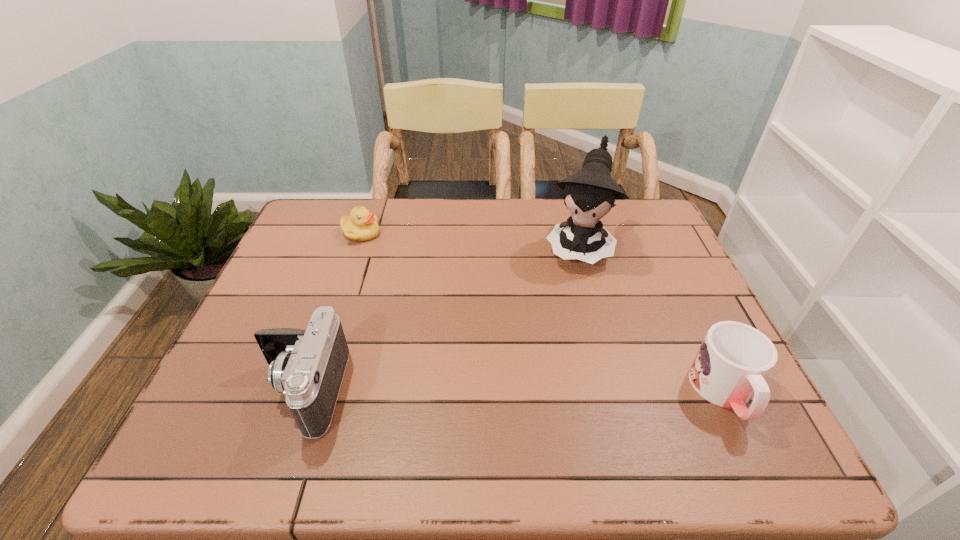
This screenshot has height=540, width=960. I want to click on the third shortest object, so click(x=307, y=366).

At what (x,y) coordinates should I click in order to perform the action: click on mug. Please return your answer as a coordinate pair (x, y). This screenshot has width=960, height=540. Looking at the image, I should click on (733, 360).

You are a GUI agent. You are given a task and a screenshot of the screen. Output one action in this format:
    pyautogui.click(x=<x>, y=<y>)
    Task: Click on the rightmost object
    The height and width of the screenshot is (540, 960).
    Given the screenshot: What is the action you would take?
    pyautogui.click(x=733, y=360)

Identify the location of duckling. The width and height of the screenshot is (960, 540). (361, 225).

This screenshot has width=960, height=540. In order to click on the third object from left to right in this screenshot , I will do `click(590, 194)`.

This screenshot has width=960, height=540. I want to click on the tallest object, so 590,194.

Locate an element on the screen. The image size is (960, 540). free region located 0.090m at the front of the third shortest object with an open lens cover is located at coordinates (218, 390).

This screenshot has width=960, height=540. In order to click on blank space located on the front-facing side of the duckling in this screenshot , I will do `click(412, 286)`.

The image size is (960, 540). I want to click on free location located 0.340m on the front-facing side of the duckling, so click(432, 307).

Find the location of a particular element. vacant space located 0.120m on the front-facing side of the duckling is located at coordinates (390, 264).